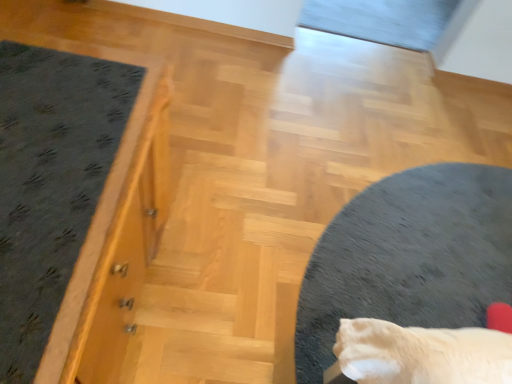
Question: Considering the relative sizes of dark gray carpet at left and soft gray carpet at center in the image provided, is dark gray carpet at left taller than soft gray carpet at center?

Choices:
 (A) yes
 (B) no

Answer: (A)

Question: Is dark gray carpet at left oriented away from soft gray carpet at center?

Choices:
 (A) no
 (B) yes

Answer: (A)

Question: Does dark gray carpet at left lie behind soft gray carpet at center?

Choices:
 (A) yes
 (B) no

Answer: (B)

Question: Is dark gray carpet at left positioned in front of soft gray carpet at center?

Choices:
 (A) no
 (B) yes

Answer: (B)

Question: Can you confirm if dark gray carpet at left is thinner than soft gray carpet at center?

Choices:
 (A) yes
 (B) no

Answer: (A)

Question: Would you consider dark gray carpet at left to be distant from soft gray carpet at center?

Choices:
 (A) no
 (B) yes

Answer: (B)

Question: Does soft gray carpet at center have a lesser width compared to dark gray carpet at left?

Choices:
 (A) no
 (B) yes

Answer: (A)

Question: From the image's perspective, is soft gray carpet at center below dark gray carpet at left?

Choices:
 (A) no
 (B) yes

Answer: (B)

Question: Is soft gray carpet at center not inside dark gray carpet at left?

Choices:
 (A) yes
 (B) no

Answer: (A)

Question: From the image's perspective, is soft gray carpet at center located above dark gray carpet at left?

Choices:
 (A) yes
 (B) no

Answer: (B)

Question: Is the position of soft gray carpet at center less distant than that of dark gray carpet at left?

Choices:
 (A) no
 (B) yes

Answer: (A)

Question: Can you confirm if soft gray carpet at center is wider than dark gray carpet at left?

Choices:
 (A) no
 (B) yes

Answer: (B)

Question: Considering the positions of point (47, 196) and point (403, 326), is point (47, 196) closer or farther from the camera than point (403, 326)?

Choices:
 (A) closer
 (B) farther

Answer: (A)